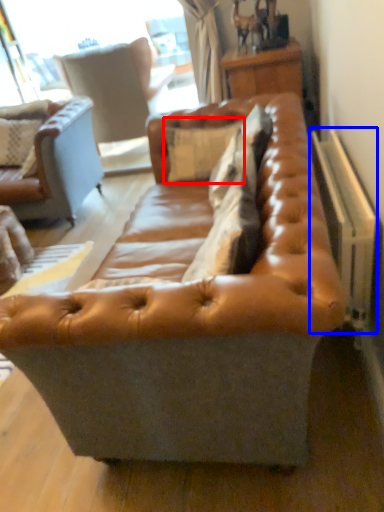
Question: Which point is closer to the camera, pillow (highlighted by a red box) or radiator (highlighted by a blue box)?

Choices:
 (A) pillow
 (B) radiator

Answer: (B)